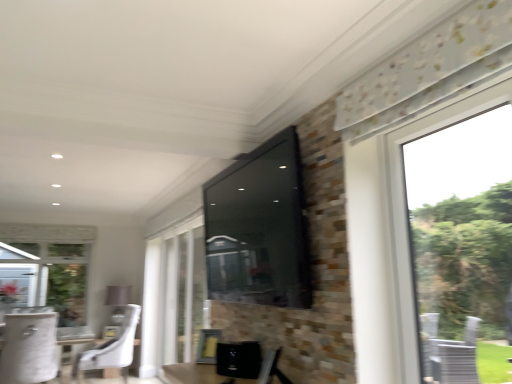
Identify the location of matte black tv at upper center. The image size is (512, 384). (259, 228).

What do you see at coordinates (173, 296) in the screenshot? I see `transparent glass window at center` at bounding box center [173, 296].

This screenshot has height=384, width=512. I want to click on white fabric chair at lower left, arranged as the second chair when viewed from the left, so tap(112, 348).

In the scene shown: Would you say white fabric round table at lower left is outside white fabric chair at lower left, the 1th chair in the left-to-right sequence?

Absolutely, white fabric round table at lower left is external to white fabric chair at lower left, the 1th chair in the left-to-right sequence.

At what (x,y) coordinates should I click in order to perform the action: click on the 2nd chair above when counting from the white fabric round table at lower left (from the image's perspective). Please return your answer as a coordinate pair (x, y). Looking at the image, I should click on (29, 348).

From a real-world perspective, is white fabric round table at lower left physically below white fabric chair at lower left, the 1th chair in the left-to-right sequence?

Correct, in the physical world, white fabric round table at lower left is lower than white fabric chair at lower left, the 1th chair in the left-to-right sequence.

Is transparent glass window at center bigger than white fabric chair at lower left, arranged as the second chair when viewed from the left?

No, transparent glass window at center is not bigger than white fabric chair at lower left, arranged as the second chair when viewed from the left.

Does transparent glass window at center have a greater height compared to white fabric chair at lower left, arranged as the second chair when viewed from the left?

Yes, transparent glass window at center is taller than white fabric chair at lower left, arranged as the second chair when viewed from the left.

Could you measure the distance between transparent glass window at center and white fabric chair at lower left, arranged as the second chair when viewed from the left?

transparent glass window at center and white fabric chair at lower left, arranged as the second chair when viewed from the left, are 35.71 inches apart from each other.

Is white fabric chair at lower left, which ranks as the second chair in right-to-left order, turned away from transparent glass window at center?

That's not correct — white fabric chair at lower left, which ranks as the second chair in right-to-left order, is not looking away from transparent glass window at center.

Does white fabric chair at lower left, the 1th chair in the left-to-right sequence, contain transparent glass window at center?

No, transparent glass window at center is located outside of white fabric chair at lower left, the 1th chair in the left-to-right sequence.

Considering the sizes of white fabric chair at lower left, which ranks as the second chair in right-to-left order, and transparent glass window at center in the image, is white fabric chair at lower left, which ranks as the second chair in right-to-left order, bigger or smaller than transparent glass window at center?

Clearly, white fabric chair at lower left, which ranks as the second chair in right-to-left order, is larger in size than transparent glass window at center.

Which object is thinner, white fabric round table at lower left or transparent glass window at center?

transparent glass window at center is thinner.

Is point (136, 340) farther from camera compared to point (197, 297)?

Yes, it is.

Where is `window that appears in front of the white fabric round table at lower left`? The image size is (512, 384). window that appears in front of the white fabric round table at lower left is located at coordinates (x=173, y=296).

From a real-world perspective, is white fabric round table at lower left physically below transparent glass window at center?

Yes, from a real-world perspective, white fabric round table at lower left is below transparent glass window at center.

From a real-world perspective, between white fabric chair at lower left, the 1th chair in the left-to-right sequence, and white fabric chair at lower left, the first chair from the right, who is vertically lower?

white fabric chair at lower left, the first chair from the right.

Is white fabric chair at lower left, the 1th chair in the left-to-right sequence, wider or thinner than white fabric chair at lower left, arranged as the second chair when viewed from the left?

Clearly, white fabric chair at lower left, the 1th chair in the left-to-right sequence, has less width compared to white fabric chair at lower left, arranged as the second chair when viewed from the left.

Considering the sizes of objects white fabric chair at lower left, which ranks as the second chair in right-to-left order, and white fabric chair at lower left, arranged as the second chair when viewed from the left, in the image provided, who is smaller, white fabric chair at lower left, which ranks as the second chair in right-to-left order, or white fabric chair at lower left, arranged as the second chair when viewed from the left,?

white fabric chair at lower left, which ranks as the second chair in right-to-left order.

Would you say matte black tv at upper center is a long distance from transparent glass window at center?

Absolutely, matte black tv at upper center is distant from transparent glass window at center.

Is the position of matte black tv at upper center more distant than that of transparent glass window at center?

No, matte black tv at upper center is closer to the viewer.

Considering the positions of points (304, 233) and (154, 365), is point (304, 233) farther from camera compared to point (154, 365)?

That is False.

From a real-world perspective, is matte black tv at upper center over transparent glass window at center?

Correct, in the physical world, matte black tv at upper center is higher than transparent glass window at center.

Which is more to the left, white fabric round table at lower left or white fabric chair at lower left, arranged as the second chair when viewed from the left?

Positioned to the left is white fabric round table at lower left.

Find the location of `chair located on the right of white fabric round table at lower left`. chair located on the right of white fabric round table at lower left is located at coordinates tap(112, 348).

Is white fabric round table at lower left looking in the opposite direction of white fabric chair at lower left, the first chair from the right?

That's not correct — white fabric round table at lower left is not looking away from white fabric chair at lower left, the first chair from the right.

Find the location of `round table located behind the white fabric chair at lower left, the 1th chair in the left-to-right sequence`. round table located behind the white fabric chair at lower left, the 1th chair in the left-to-right sequence is located at coordinates (75, 344).

This screenshot has width=512, height=384. Identify the location of window located above the white fabric chair at lower left, the first chair from the right (from a real-world perspective). (173, 296).

Looking at this image, which object lies further to the anchor point white fabric round table at lower left, transparent glass window at center or matte black tv at upper center?

matte black tv at upper center is positioned further to the anchor white fabric round table at lower left.

Estimate the real-world distances between objects in this image. Which object is further from white fabric chair at lower left, which ranks as the second chair in right-to-left order, white fabric round table at lower left or matte black tv at upper center?

Based on the image, matte black tv at upper center appears to be further to white fabric chair at lower left, which ranks as the second chair in right-to-left order.

Based on their spatial positions, is white fabric chair at lower left, arranged as the second chair when viewed from the left, or white fabric round table at lower left closer to matte black tv at upper center?

The object closer to matte black tv at upper center is white fabric chair at lower left, arranged as the second chair when viewed from the left.

Considering their positions, is transparent glass window at center positioned further to white fabric chair at lower left, the 1th chair in the left-to-right sequence, than white fabric chair at lower left, the first chair from the right?

The object further to white fabric chair at lower left, the 1th chair in the left-to-right sequence, is transparent glass window at center.

Based on their spatial positions, is white fabric chair at lower left, arranged as the second chair when viewed from the left, or matte black tv at upper center further from white fabric round table at lower left?

matte black tv at upper center.

Based on their spatial positions, is matte black tv at upper center or white fabric chair at lower left, which ranks as the second chair in right-to-left order, closer to white fabric chair at lower left, arranged as the second chair when viewed from the left?

white fabric chair at lower left, which ranks as the second chair in right-to-left order, is positioned closer to the anchor white fabric chair at lower left, arranged as the second chair when viewed from the left.

Considering their positions, is white fabric chair at lower left, the 1th chair in the left-to-right sequence, positioned closer to white fabric round table at lower left than white fabric chair at lower left, the first chair from the right?

Among the two, white fabric chair at lower left, the first chair from the right, is located nearer to white fabric round table at lower left.

When comparing their distances from white fabric chair at lower left, which ranks as the second chair in right-to-left order, does white fabric chair at lower left, the first chair from the right, or white fabric round table at lower left seem closer?

Among the two, white fabric chair at lower left, the first chair from the right, is located nearer to white fabric chair at lower left, which ranks as the second chair in right-to-left order.

Locate an element on the screen. chair positioned between matte black tv at upper center and transparent glass window at center from near to far is located at coordinates pyautogui.click(x=29, y=348).

At what (x,y) coordinates should I click in order to perform the action: click on window between matte black tv at upper center and white fabric chair at lower left, arranged as the second chair when viewed from the left, along the z-axis. Please return your answer as a coordinate pair (x, y). This screenshot has height=384, width=512. Looking at the image, I should click on (173, 296).

Where is `window positioned between matte black tv at upper center and white fabric round table at lower left from near to far`? The width and height of the screenshot is (512, 384). window positioned between matte black tv at upper center and white fabric round table at lower left from near to far is located at coordinates (173, 296).

This screenshot has height=384, width=512. Find the location of `window positioned between white fabric chair at lower left, the 1th chair in the left-to-right sequence, and white fabric round table at lower left from near to far`. window positioned between white fabric chair at lower left, the 1th chair in the left-to-right sequence, and white fabric round table at lower left from near to far is located at coordinates (173, 296).